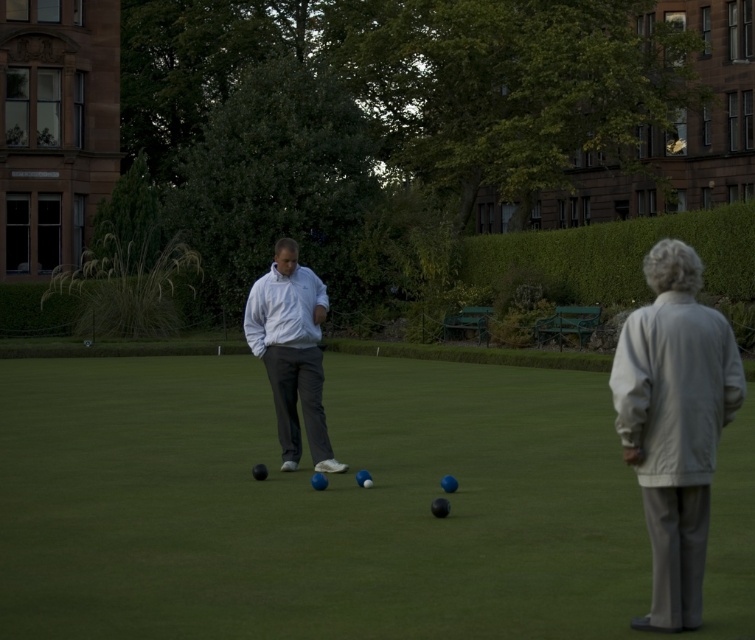
From the picture: You are a photographer positioned at the edge of the lawn. You want to take a photo that includes both the light gray fabric jacket at right and the white matte jacket at center. Which jacket should you adjust your camera angle to focus on first to ensure both are in frame?

The light gray fabric jacket at right is to the right of the white matte jacket at center, so you should focus on the white matte jacket at center first to ensure both are in frame.

You are standing in the park and want to pick up an object from the green grass at center. However, there is a white matte jacket at center in your way. Can you reach the grass without moving the jacket?

The green grass at center is closer to the viewer than the white matte jacket at center, so you can reach the grass without moving the jacket because it is in front of the jacket.